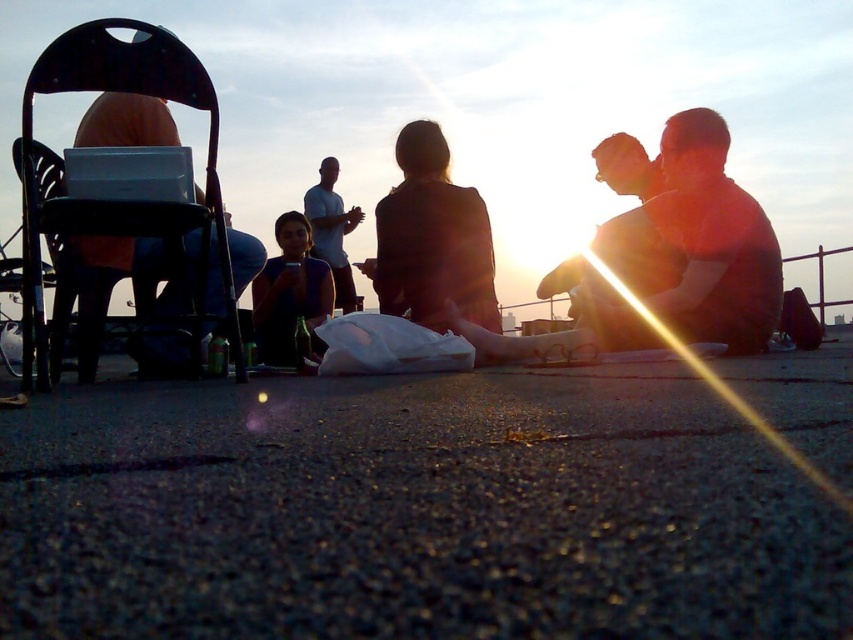
Which is more to the right, black plastic chair at left or silhouette fabric jacket at center?

From the viewer's perspective, silhouette fabric jacket at center appears more on the right side.

Does black plastic chair at left appear under silhouette fabric jacket at center?

Correct, black plastic chair at left is located below silhouette fabric jacket at center.

I want to click on black plastic chair at left, so click(x=114, y=208).

The image size is (853, 640). I want to click on black plastic chair at left, so coord(114,208).

Is matte black shirt at center closer to the viewer compared to white cotton shirt at center?

That is True.

This screenshot has width=853, height=640. Find the location of `matte black shirt at center`. matte black shirt at center is located at coordinates (289, 292).

In the scene shown: Who is more distant from viewer, [283,257] or [331,156]?

Positioned behind is point [331,156].

What are the coordinates of `matte black shirt at center` in the screenshot? It's located at (289, 292).

Who is more forward, (173, 52) or (292, 300)?

Point (173, 52)

This screenshot has height=640, width=853. Find the location of `black plastic chair at left`. black plastic chair at left is located at coordinates (114, 208).

Find the location of a particular element. black plastic chair at left is located at coordinates (114, 208).